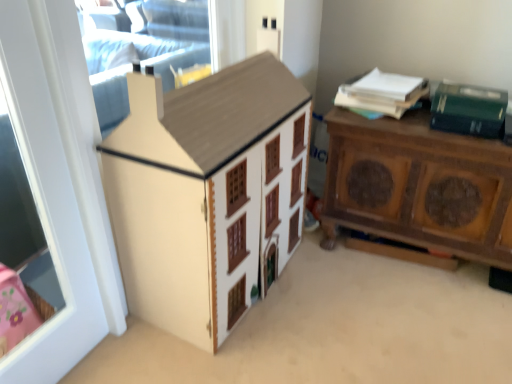
Where is `free spot in front of matte wood cabinet at center`? This screenshot has height=384, width=512. free spot in front of matte wood cabinet at center is located at coordinates (236, 351).